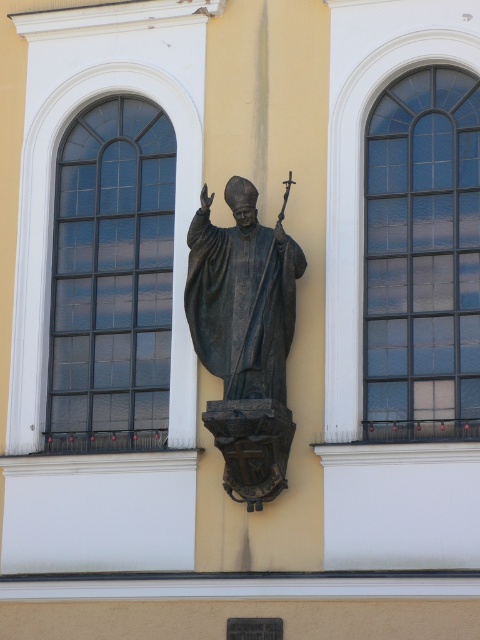
You are an architect assessing the building facade. You notice the clear glass window at right and the black glass window at left. Which window has a larger surface area?

The clear glass window at right has a larger surface area than the black glass window at left.

You are an art student standing in front of the building and want to sketch the statue. You notice the clear glass window at right and the black glass window at left. Which window is positioned closer to you?

The clear glass window at right is closer to the viewer than the black glass window at left.

Consider the image. You are standing outside the building and want to take a photo of the bronze statue at center. However, the clear glass window at right is blocking your view. Can you move to the left to get a clear shot without the window in the frame?

The clear glass window at right is in front of the bronze statue at center, so moving to the left might allow you to position yourself where the window no longer blocks the statue, providing a clear view.